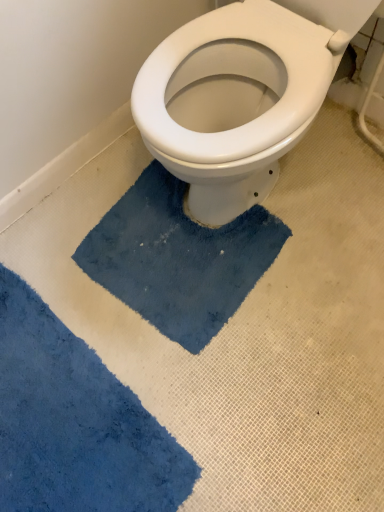
Question: From a real-world perspective, relative to blue plush bath mat at center, which is the second bath mat in bottom-to-top order, is blue soft rug at lower left, the second bath mat positioned from the top, vertically above or below?

Choices:
 (A) above
 (B) below

Answer: (B)

Question: From their relative heights in the image, would you say blue soft rug at lower left, the first bath mat from the bottom, is taller or shorter than blue plush bath mat at center, which is the first bath mat in top-to-bottom order?

Choices:
 (A) tall
 (B) short

Answer: (B)

Question: Based on their sizes in the image, would you say blue soft rug at lower left, the first bath mat from the bottom, is bigger or smaller than blue plush bath mat at center, which is the second bath mat in bottom-to-top order?

Choices:
 (A) big
 (B) small

Answer: (A)

Question: From the image's perspective, relative to blue soft rug at lower left, the first bath mat from the bottom, is blue plush bath mat at center, which is the first bath mat in top-to-bottom order, above or below?

Choices:
 (A) below
 (B) above

Answer: (B)

Question: Considering the positions of blue plush bath mat at center, which is the first bath mat in top-to-bottom order, and blue soft rug at lower left, the first bath mat from the bottom, in the image, is blue plush bath mat at center, which is the first bath mat in top-to-bottom order, wider or thinner than blue soft rug at lower left, the first bath mat from the bottom,?

Choices:
 (A) wide
 (B) thin

Answer: (A)

Question: Relative to blue soft rug at lower left, the second bath mat positioned from the top, is blue plush bath mat at center, which is the second bath mat in bottom-to-top order, in front or behind?

Choices:
 (A) behind
 (B) front

Answer: (A)

Question: Considering the positions of point (119, 215) and point (109, 472), is point (119, 215) closer or farther from the camera than point (109, 472)?

Choices:
 (A) closer
 (B) farther

Answer: (B)